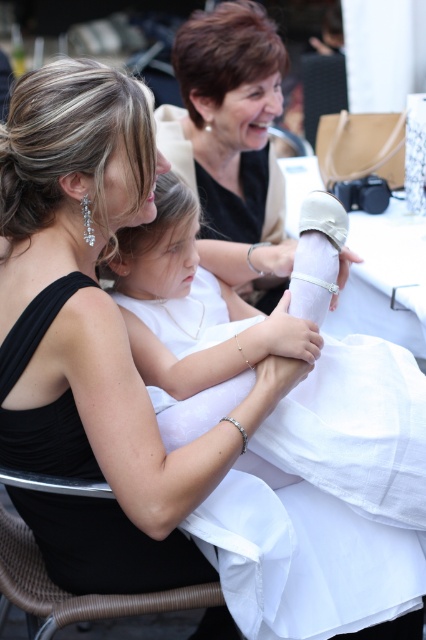
Looking at this image, does matte black dress at upper center have a greater height compared to white satin tablecloth at center?

Correct, matte black dress at upper center is much taller as white satin tablecloth at center.

Can you confirm if matte black dress at upper center is thinner than white satin tablecloth at center?

Yes, matte black dress at upper center is thinner than white satin tablecloth at center.

Does point (273, 164) come behind point (317, 177)?

No, it is not.

The height and width of the screenshot is (640, 426). In order to click on matte black dress at upper center in this screenshot , I will do `click(229, 120)`.

Between point (25, 429) and point (348, 240), which one is positioned in front?

Positioned in front is point (25, 429).

Can you confirm if white satin dress at center is shorter than white satin tablecloth at center?

Yes, white satin dress at center is shorter than white satin tablecloth at center.

Between point (55, 564) and point (336, 328), which one is positioned behind?

Positioned behind is point (336, 328).

Locate an element on the screen. The image size is (426, 640). white satin dress at center is located at coordinates (106, 547).

In the scene shown: Is matte black dress at upper center above white satin dress at center?

Yes.

Is matte black dress at upper center smaller than white satin dress at center?

Actually, matte black dress at upper center might be larger than white satin dress at center.

Does point (238, 157) come in front of point (8, 410)?

No.

Where is `matte black dress at upper center`? The height and width of the screenshot is (640, 426). matte black dress at upper center is located at coordinates (229, 120).